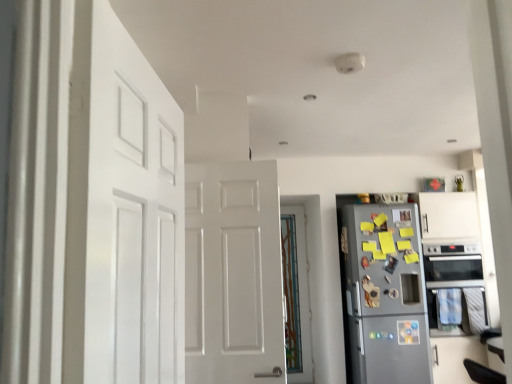
Describe the element at coordinates (456, 285) in the screenshot. I see `black glass oven at right` at that location.

What is the approximate height of metallic gray refrigerator at right?

metallic gray refrigerator at right is 1.83 meters in height.

The width and height of the screenshot is (512, 384). What do you see at coordinates (296, 295) in the screenshot?
I see `translucent glass door at center, the second door viewed from the left` at bounding box center [296, 295].

The height and width of the screenshot is (384, 512). Find the location of `white matte door at left, the second door positioned from the right`. white matte door at left, the second door positioned from the right is located at coordinates 132,216.

Considering the positions of objects white matte door at left, the second door positioned from the right, and metallic gray refrigerator at right in the image provided, who is more to the right, white matte door at left, the second door positioned from the right, or metallic gray refrigerator at right?

From the viewer's perspective, metallic gray refrigerator at right appears more on the right side.

How different are the orientations of white matte door at left, the first door in the front-to-back sequence, and metallic gray refrigerator at right in degrees?

white matte door at left, the first door in the front-to-back sequence, and metallic gray refrigerator at right are facing 81.3 degrees away from each other.

From a real-world perspective, is white matte door at left, the second door positioned from the right, positioned over metallic gray refrigerator at right based on gravity?

Yes, from a real-world perspective, white matte door at left, the second door positioned from the right, is over metallic gray refrigerator at right

Consider the image. Which of these two, white matte door at left, placed as the first door when sorted from left to right, or metallic gray refrigerator at right, is bigger?

Bigger between the two is metallic gray refrigerator at right.

Considering the positions of objects metallic gray refrigerator at right and black glass oven at right in the image provided, who is in front, metallic gray refrigerator at right or black glass oven at right?

metallic gray refrigerator at right is in front.

From a real-world perspective, which object stands above the other?

black glass oven at right.

Does point (366, 319) lie behind point (459, 271)?

No.

From the image's perspective, which one is positioned lower, black glass oven at right or translucent glass door at center, the second door viewed from the left?

From the image's view, translucent glass door at center, the second door viewed from the left, is below.

Is black glass oven at right far from translucent glass door at center, the 1th door from the right?

Absolutely, black glass oven at right is distant from translucent glass door at center, the 1th door from the right.

How many degrees apart are the facing directions of black glass oven at right and translucent glass door at center, the second door viewed from the left?

They differ by 3.55 degrees in their facing directions.

From a real-world perspective, relative to translucent glass door at center, the 1th door from the right, is black glass oven at right vertically above or below?

black glass oven at right is situated higher than translucent glass door at center, the 1th door from the right, in the real world.

From a real-world perspective, is metallic gray refrigerator at right above or below translucent glass door at center, the second door viewed from the left?

From a real-world perspective, metallic gray refrigerator at right is physically below translucent glass door at center, the second door viewed from the left.

Is the position of metallic gray refrigerator at right less distant than that of translucent glass door at center, the second door viewed from the left?

Yes, it is in front of translucent glass door at center, the second door viewed from the left.

Where is `refrigerator directly beneath the translucent glass door at center, the 1th door viewed from the back (from a real-world perspective)`? This screenshot has height=384, width=512. refrigerator directly beneath the translucent glass door at center, the 1th door viewed from the back (from a real-world perspective) is located at coordinates (x=386, y=294).

In the scene shown: Can you confirm if white matte door at left, the first door in the front-to-back sequence, is shorter than translucent glass door at center, the second door viewed from the left?

Indeed, white matte door at left, the first door in the front-to-back sequence, has a lesser height compared to translucent glass door at center, the second door viewed from the left.

Can you confirm if white matte door at left, the second door positioned from the right, is bigger than translucent glass door at center, the second door viewed from the left?

Yes.

Where is `door on the left of translucent glass door at center, the 1th door viewed from the back`? door on the left of translucent glass door at center, the 1th door viewed from the back is located at coordinates (132, 216).

Could you measure the distance between white matte door at left, placed as the first door when sorted from left to right, and translucent glass door at center, the second door viewed from the left?

They are 3.18 meters apart.

From a real-world perspective, which object stands above the other?

In real-world perspective, translucent glass door at center, the 1th door from the right, is above.

From the image's perspective, which is above, translucent glass door at center, the 1th door from the right, or metallic gray refrigerator at right?

metallic gray refrigerator at right.

Which is more to the left, translucent glass door at center, the second door viewed from the left, or metallic gray refrigerator at right?

From the viewer's perspective, translucent glass door at center, the second door viewed from the left, appears more on the left side.

Does translucent glass door at center, marked as the second door in a front-to-back arrangement, contain metallic gray refrigerator at right?

That's incorrect, metallic gray refrigerator at right is not inside translucent glass door at center, marked as the second door in a front-to-back arrangement.

Is white matte door at left, the second door positioned from the right, touching black glass oven at right?

white matte door at left, the second door positioned from the right, is not next to black glass oven at right, and they're not touching.

From a real-world perspective, is white matte door at left, placed as the first door when sorted from left to right, above or below black glass oven at right?

In terms of real-world spatial position, white matte door at left, placed as the first door when sorted from left to right, is above black glass oven at right.

Does white matte door at left, the first door in the front-to-back sequence, have a larger size compared to black glass oven at right?

No, white matte door at left, the first door in the front-to-back sequence, is not bigger than black glass oven at right.

Which is in front, white matte door at left, placed as the second door when sorted from back to front, or black glass oven at right?

white matte door at left, placed as the second door when sorted from back to front, is more forward.

Where is `refrigerator lying behind the white matte door at left, the second door positioned from the right`? refrigerator lying behind the white matte door at left, the second door positioned from the right is located at coordinates (386, 294).

The image size is (512, 384). Identify the location of oven that appears on the right of metallic gray refrigerator at right. (456, 285).

Looking at the image, which one is located closer to translucent glass door at center, marked as the second door in a front-to-back arrangement, white matte door at left, the second door positioned from the right, or metallic gray refrigerator at right?

Based on the image, metallic gray refrigerator at right appears to be nearer to translucent glass door at center, marked as the second door in a front-to-back arrangement.

Based on their spatial positions, is metallic gray refrigerator at right or black glass oven at right closer to white matte door at left, the first door in the front-to-back sequence?

metallic gray refrigerator at right is positioned closer to the anchor white matte door at left, the first door in the front-to-back sequence.

Estimate the real-world distances between objects in this image. Which object is further from translucent glass door at center, the 1th door viewed from the back, metallic gray refrigerator at right or white matte door at left, placed as the second door when sorted from back to front?

white matte door at left, placed as the second door when sorted from back to front, is further to translucent glass door at center, the 1th door viewed from the back.

When comparing their distances from black glass oven at right, does translucent glass door at center, the 1th door viewed from the back, or metallic gray refrigerator at right seem closer?

metallic gray refrigerator at right lies closer to black glass oven at right than the other object.

Estimate the real-world distances between objects in this image. Which object is further from translucent glass door at center, marked as the second door in a front-to-back arrangement, black glass oven at right or metallic gray refrigerator at right?

black glass oven at right is positioned further to the anchor translucent glass door at center, marked as the second door in a front-to-back arrangement.

Considering their positions, is black glass oven at right positioned further to translucent glass door at center, marked as the second door in a front-to-back arrangement, than white matte door at left, placed as the second door when sorted from back to front?

white matte door at left, placed as the second door when sorted from back to front, is further to translucent glass door at center, marked as the second door in a front-to-back arrangement.

Estimate the real-world distances between objects in this image. Which object is closer to black glass oven at right, white matte door at left, placed as the first door when sorted from left to right, or translucent glass door at center, the 1th door from the right?

Based on the image, translucent glass door at center, the 1th door from the right, appears to be nearer to black glass oven at right.

From the image, which object appears to be nearer to metallic gray refrigerator at right, black glass oven at right or translucent glass door at center, the second door viewed from the left?

black glass oven at right is positioned closer to the anchor metallic gray refrigerator at right.

The width and height of the screenshot is (512, 384). Identify the location of oven between white matte door at left, the first door in the front-to-back sequence, and translucent glass door at center, the second door viewed from the left, from front to back. (456, 285).

I want to click on refrigerator between white matte door at left, placed as the first door when sorted from left to right, and translucent glass door at center, the 1th door from the right, from front to back, so click(386, 294).

I want to click on refrigerator positioned between white matte door at left, the first door in the front-to-back sequence, and black glass oven at right from near to far, so click(386, 294).

The width and height of the screenshot is (512, 384). Identify the location of refrigerator located between translucent glass door at center, marked as the second door in a front-to-back arrangement, and black glass oven at right in the left-right direction. (386, 294).